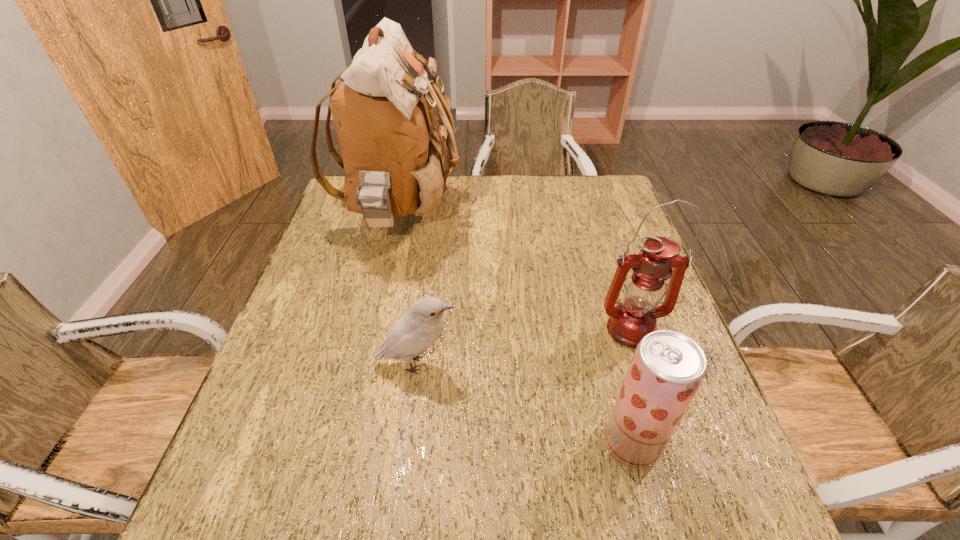
Identify the location of free space located on the left of the nearest object. (422, 443).

What are the coordinates of `free space located 0.320m at the beak of the second nearest object` in the screenshot? It's located at (606, 364).

Where is `object located at the far edge`? object located at the far edge is located at coordinates (394, 148).

At what (x,y) coordinates should I click in order to perform the action: click on object that is positioned at the left edge. Please return your answer as a coordinate pair (x, y). This screenshot has width=960, height=540. Looking at the image, I should click on (394, 148).

Find the location of a particular element. The height and width of the screenshot is (540, 960). oil lamp at the right edge is located at coordinates (635, 317).

Locate an element on the screen. The width and height of the screenshot is (960, 540). fruit juice present at the right edge is located at coordinates (667, 368).

The height and width of the screenshot is (540, 960). What are the coordinates of `object situated at the far left corner` in the screenshot? It's located at (394, 148).

In the image, there is a desktop. Identify the location of vacant area at the far edge. The height and width of the screenshot is (540, 960). (565, 200).

The height and width of the screenshot is (540, 960). Find the location of `free space at the left edge of the desktop`. free space at the left edge of the desktop is located at coordinates (347, 225).

In the image, there is a desktop. In order to click on vacant space at the right edge in this screenshot , I will do `click(609, 278)`.